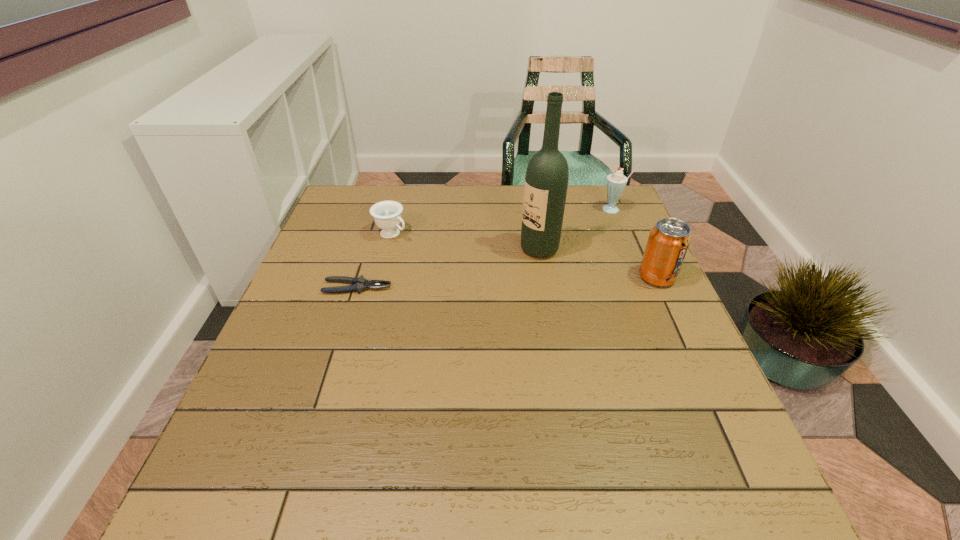
The height and width of the screenshot is (540, 960). Find the location of `vacant space on the desktop that is between the shortest object and the soda can and is positioned on the straw side of the farthest object`. vacant space on the desktop that is between the shortest object and the soda can and is positioned on the straw side of the farthest object is located at coordinates (542, 281).

This screenshot has height=540, width=960. In order to click on vacant spot on the desktop that is between the shortest object and the soda can and is positioned on the side of the fourth tallest object with the handle in this screenshot , I will do `click(472, 284)`.

Find the location of a particular element. This screenshot has width=960, height=540. vacant space on the desktop that is between the shortest object and the soda can and is positioned on the labeled side of the tallest object is located at coordinates pos(487,283).